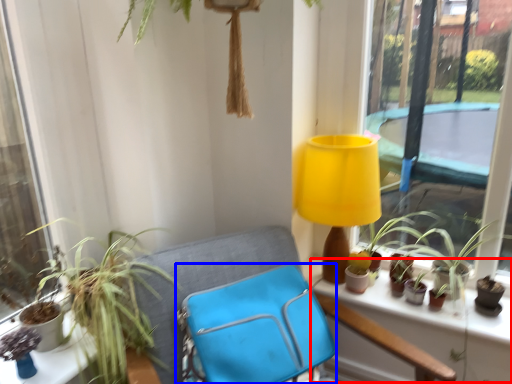
Question: Which object is further to the camera taking this photo, window sill (highlighted by a red box) or folding chair (highlighted by a blue box)?

Choices:
 (A) window sill
 (B) folding chair

Answer: (A)